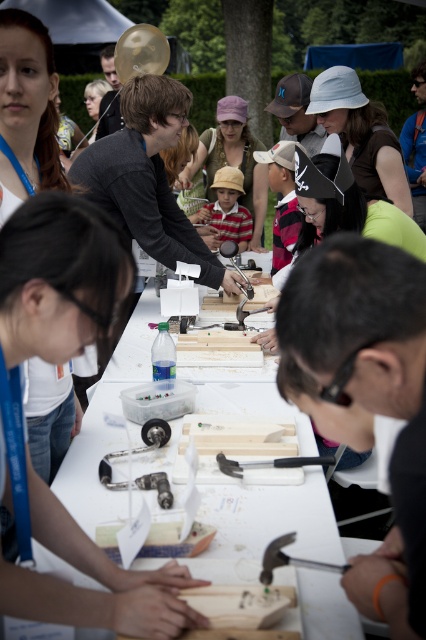
Question: Can you confirm if smooth wooden block at center is positioned above white wood table at center?

Choices:
 (A) no
 (B) yes

Answer: (B)

Question: Does smooth wooden block at center come in front of white wood table at center?

Choices:
 (A) no
 (B) yes

Answer: (B)

Question: Which object is the closest to the metallic hammer at lower center?

Choices:
 (A) white wood table at center
 (B) smooth wooden block at center

Answer: (B)

Question: From the image, what is the correct spatial relationship of smooth wooden block at center in relation to white wood table at center?

Choices:
 (A) left
 (B) right

Answer: (B)

Question: Which point is closer to the camera?

Choices:
 (A) white wood table at center
 (B) smooth wooden block at center

Answer: (B)

Question: Which point is farther to the camera?

Choices:
 (A) (86, 593)
 (B) (305, 276)

Answer: (A)